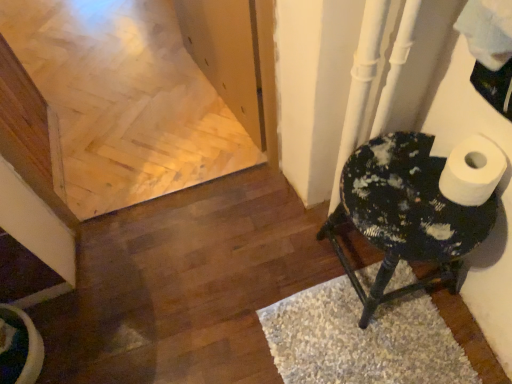
Locate an element on the screen. The width and height of the screenshot is (512, 384). white shaggy rug at lower right is located at coordinates (361, 340).

Describe the element at coordinates (361, 340) in the screenshot. Image resolution: width=512 pixels, height=384 pixels. I see `white shaggy rug at lower right` at that location.

The width and height of the screenshot is (512, 384). What are the coordinates of `speckled black stool at right` in the screenshot? It's located at (414, 208).

The height and width of the screenshot is (384, 512). Describe the element at coordinates (414, 208) in the screenshot. I see `speckled black stool at right` at that location.

Where is `white shaggy rug at lower right`? white shaggy rug at lower right is located at coordinates (361, 340).

Is speckled black stool at right at the left side of white shaggy rug at lower right?

In fact, speckled black stool at right is to the right of white shaggy rug at lower right.

Is speckled black stool at right in front of or behind white shaggy rug at lower right in the image?

speckled black stool at right is positioned closer to the viewer than white shaggy rug at lower right.

Between point (388, 220) and point (310, 381), which one is positioned in front?

The point (388, 220) is closer.

From the image's perspective, is speckled black stool at right over white shaggy rug at lower right?

Correct, speckled black stool at right appears higher than white shaggy rug at lower right in the image.

From a real-world perspective, is speckled black stool at right positioned under white shaggy rug at lower right based on gravity?

No, from a real-world perspective, speckled black stool at right is not under white shaggy rug at lower right.

Which of these two, speckled black stool at right or white shaggy rug at lower right, is wider?

With larger width is white shaggy rug at lower right.

Who is shorter, speckled black stool at right or white shaggy rug at lower right?

With less height is white shaggy rug at lower right.

Considering the relative sizes of speckled black stool at right and white shaggy rug at lower right in the image provided, is speckled black stool at right bigger than white shaggy rug at lower right?

Correct, speckled black stool at right is larger in size than white shaggy rug at lower right.

Does speckled black stool at right contain white shaggy rug at lower right?

No, white shaggy rug at lower right is located outside of speckled black stool at right.

Is speckled black stool at right beside white shaggy rug at lower right?

They are not placed beside each other.

Is speckled black stool at right facing away from white shaggy rug at lower right?

speckled black stool at right is not turned away from white shaggy rug at lower right.

What's the angular difference between speckled black stool at right and white shaggy rug at lower right's facing directions?

The facing directions of speckled black stool at right and white shaggy rug at lower right are 87.9 degrees apart.

Identify the location of doormat below the speckled black stool at right (from the image's perspective). The height and width of the screenshot is (384, 512). (361, 340).

Does white shaggy rug at lower right appear on the left side of speckled black stool at right?

Yes.

Is the position of white shaggy rug at lower right less distant than that of speckled black stool at right?

No, white shaggy rug at lower right is further to the viewer.

Which point is more distant from viewer, (406, 265) or (378, 187)?

The point (406, 265) is more distant.

From the image's perspective, does white shaggy rug at lower right appear lower than speckled black stool at right?

Yes, from the image's perspective, white shaggy rug at lower right is below speckled black stool at right.

From a real-world perspective, is white shaggy rug at lower right on speckled black stool at right?

No, from a real-world perspective, white shaggy rug at lower right is not on top of speckled black stool at right.

Does white shaggy rug at lower right have a greater width compared to speckled black stool at right?

Correct, the width of white shaggy rug at lower right exceeds that of speckled black stool at right.

Does white shaggy rug at lower right have a greater height compared to speckled black stool at right?

→ No.

Considering the relative sizes of white shaggy rug at lower right and speckled black stool at right in the image provided, is white shaggy rug at lower right smaller than speckled black stool at right?

Indeed, white shaggy rug at lower right has a smaller size compared to speckled black stool at right.

Is white shaggy rug at lower right spatially inside speckled black stool at right, or outside of it?

white shaggy rug at lower right is not enclosed by speckled black stool at right.

Are white shaggy rug at lower right and speckled black stool at right beside each other?

white shaggy rug at lower right and speckled black stool at right are clearly separated.

Does white shaggy rug at lower right turn towards speckled black stool at right?

No, white shaggy rug at lower right is not aimed at speckled black stool at right.

What are the coordinates of `furniture above the white shaggy rug at lower right (from a real-world perspective)` in the screenshot? It's located at (414, 208).

In order to click on furniture that is above the white shaggy rug at lower right (from the image's perspective) in this screenshot , I will do pyautogui.click(x=414, y=208).

Find the location of `doormat below the speckled black stool at right (from the image's perspective)`. doormat below the speckled black stool at right (from the image's perspective) is located at coordinates (361, 340).